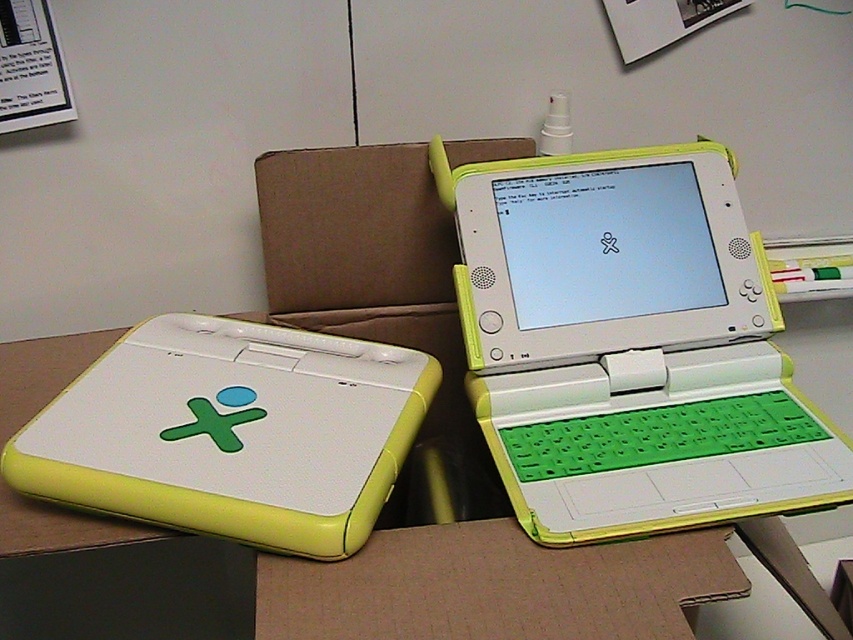
You are organizing a classroom and need to place a new whiteboard behind the white plastic table at center so it can be seen by students sitting at the table. However, there is already a brown cardboard at center behind the table. Can the whiteboard be placed there without blocking the view of the students?

The white plastic table at center is in front of the brown cardboard at center, so placing the whiteboard behind the table would place it behind the cardboard. This would block the students sitting at the table from seeing the whiteboard.

You are holding a measuring tape and need to determine if the distance between your eyes and the point at coordinates point (671, 388) is less than 1 meter. Can you confirm this?

The distance between the point (671, 388) and the viewer is 91.52 centimeters, which is less than 1 meter. Yes, the distance is under 1 meter.